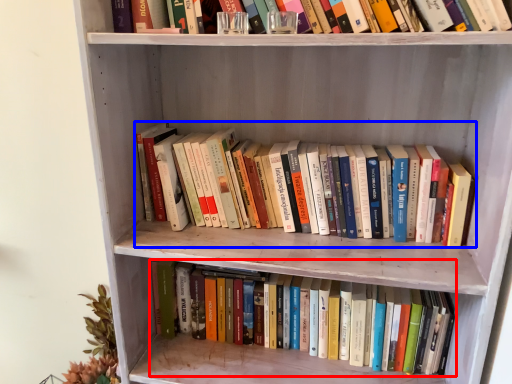
Question: Which point is closer to the camera, book (highlighted by a red box) or book (highlighted by a blue box)?

Choices:
 (A) book
 (B) book

Answer: (B)